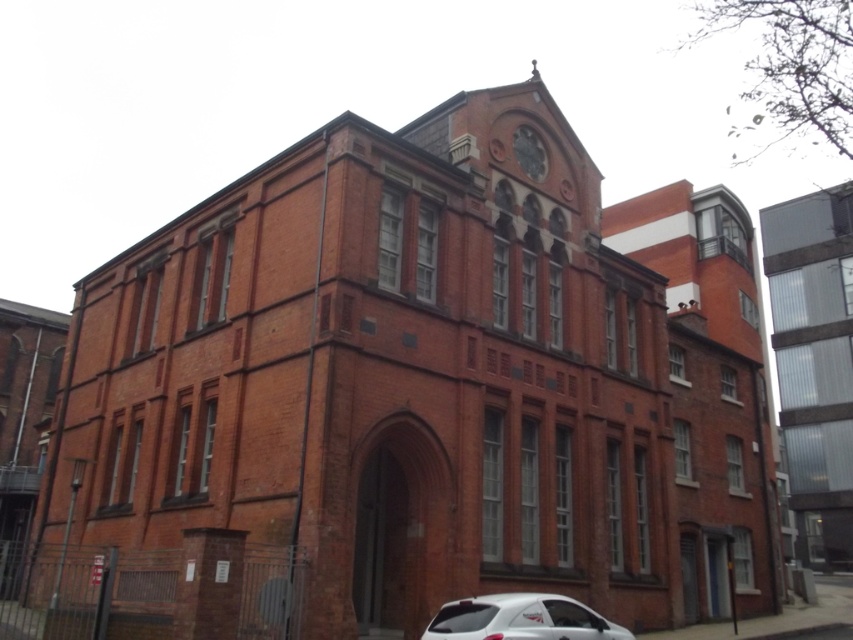
Consider the image. Can you confirm if clear glass building at right is smaller than white glossy car at lower center?

Incorrect, clear glass building at right is not smaller in size than white glossy car at lower center.

Locate an element on the screen. The image size is (853, 640). clear glass building at right is located at coordinates [814, 362].

The height and width of the screenshot is (640, 853). What do you see at coordinates (814, 362) in the screenshot? I see `clear glass building at right` at bounding box center [814, 362].

Where is `clear glass building at right`? The height and width of the screenshot is (640, 853). clear glass building at right is located at coordinates (814, 362).